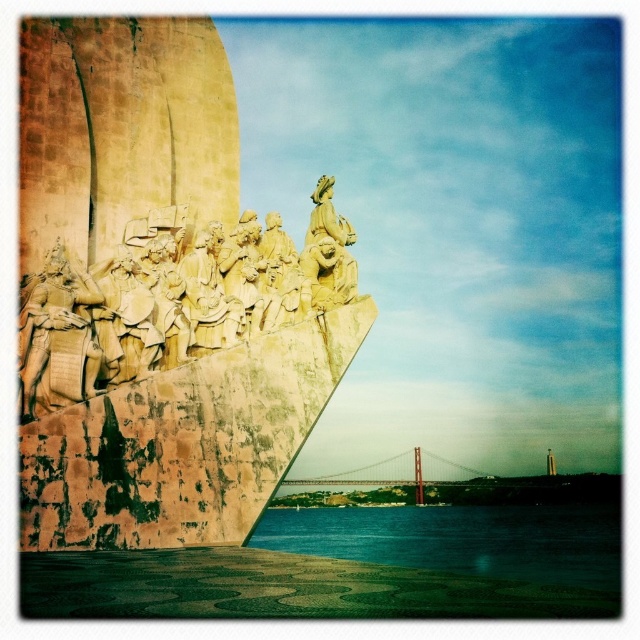
What do you see at coordinates (173, 300) in the screenshot? This screenshot has width=640, height=640. I see `yellow stone sculpture at upper left` at bounding box center [173, 300].

Is yellow stone sculpture at upper left positioned at the back of golden metallic suspension bridge at center?

No, it is not.

You are a GUI agent. You are given a task and a screenshot of the screen. Output one action in this format:
    pyautogui.click(x=<x>, y=<y>)
    Task: Click on the yellow stone sculpture at upper left
    This screenshot has width=640, height=640.
    Given the screenshot: What is the action you would take?
    pyautogui.click(x=173, y=300)

Who is taller, golden stone monument at left or yellow stone sculpture at upper left?

Standing taller between the two is golden stone monument at left.

What do you see at coordinates (157, 296) in the screenshot? I see `golden stone monument at left` at bounding box center [157, 296].

Identify the location of golden stone monument at left. The image size is (640, 640). (157, 296).

The height and width of the screenshot is (640, 640). In order to click on yellow stone sculpture at upper left in this screenshot , I will do `click(173, 300)`.

Who is positioned more to the left, yellow stone sculpture at upper left or blue water at lower center?

yellow stone sculpture at upper left is more to the left.

Locate an element on the screen. This screenshot has width=640, height=640. yellow stone sculpture at upper left is located at coordinates (173, 300).

Where is `yellow stone sculpture at upper left`? The image size is (640, 640). yellow stone sculpture at upper left is located at coordinates (173, 300).